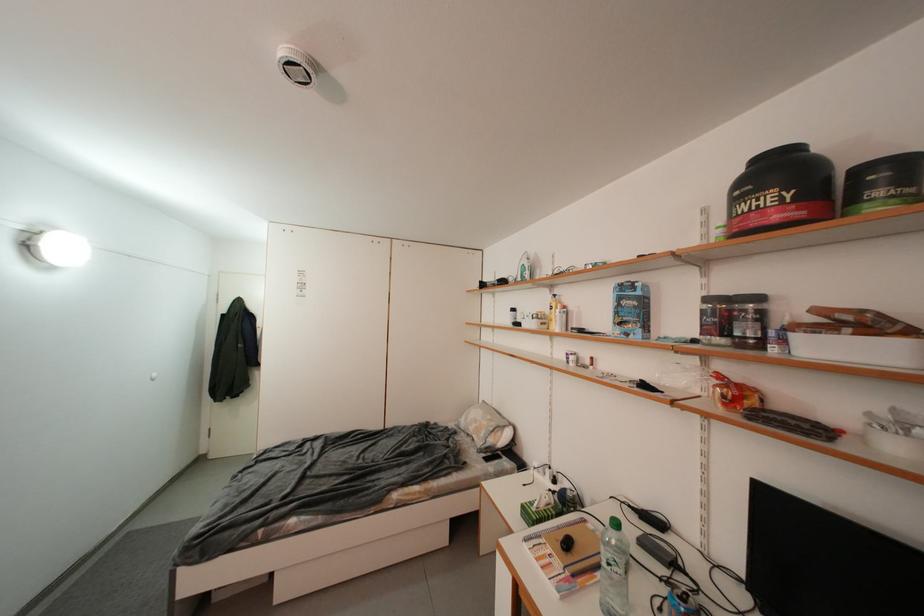
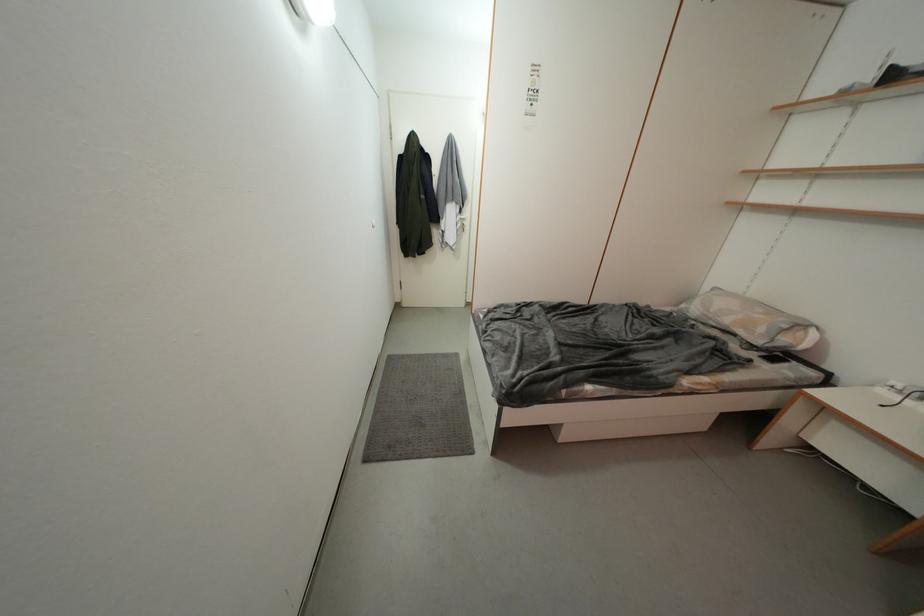
In the second image, find the point that corresponds to the point at 490,437 in the first image.

(769, 333)